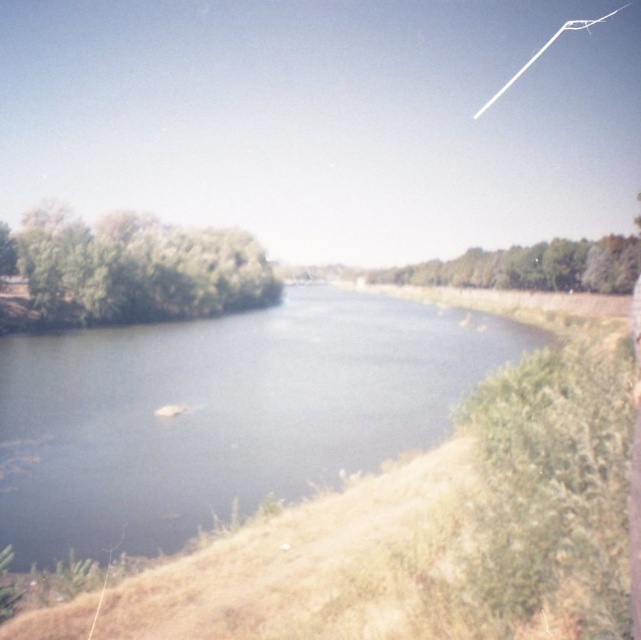
Does point (97, 548) lie behind point (63, 305)?

No, (97, 548) is closer to viewer.

Who is taller, blue water at center or green leafy tree at left?

Standing taller between the two is green leafy tree at left.

Does point (404, 332) come farther from viewer compared to point (253, 273)?

No, it is not.

Where is `blue water at center`? Image resolution: width=641 pixels, height=640 pixels. blue water at center is located at coordinates (222, 413).

Who is positioned more to the right, blue water at center or green leafy trees at center?

green leafy trees at center is more to the right.

In the scene shown: Between blue water at center and green leafy trees at center, which one has less height?

With less height is blue water at center.

What do you see at coordinates (222, 413) in the screenshot?
I see `blue water at center` at bounding box center [222, 413].

Find the location of a particular element. blue water at center is located at coordinates (222, 413).

Is green leafy tree at left smaller than green leafy trees at center?

Indeed, green leafy tree at left has a smaller size compared to green leafy trees at center.

What do you see at coordinates (137, 269) in the screenshot? The width and height of the screenshot is (641, 640). I see `green leafy tree at left` at bounding box center [137, 269].

This screenshot has height=640, width=641. What do you see at coordinates (137, 269) in the screenshot? I see `green leafy tree at left` at bounding box center [137, 269].

In order to click on green leafy tree at left in this screenshot , I will do `click(137, 269)`.